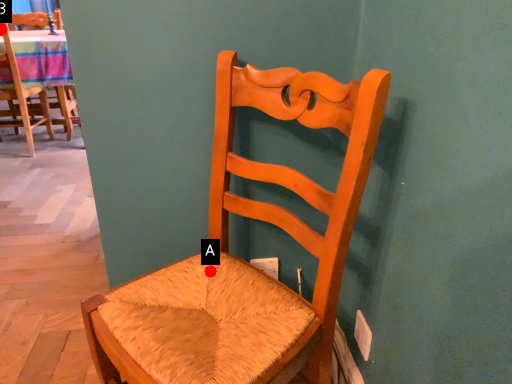
Question: Two points are circled on the image, labeled by A and B beside each circle. Which point appears closest to the camera in this image?

Choices:
 (A) A is closer
 (B) B is closer

Answer: (A)